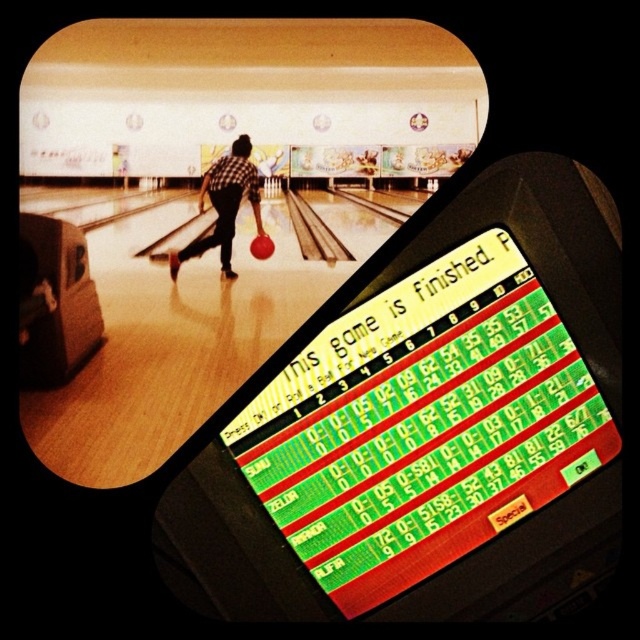
Question: Can you confirm if checkered fabric shirt at center is positioned to the right of shiny red bowling ball at center?

Choices:
 (A) yes
 (B) no

Answer: (B)

Question: Which object appears farthest from the camera in this image?

Choices:
 (A) checkered fabric shirt at center
 (B) shiny red bowling ball at center

Answer: (B)

Question: Which of the following is the closest to the observer?

Choices:
 (A) (257, 221)
 (B) (256, 243)

Answer: (B)

Question: Can you confirm if checkered fabric shirt at center is positioned to the right of shiny red bowling ball at center?

Choices:
 (A) no
 (B) yes

Answer: (A)

Question: Is checkered fabric shirt at center behind shiny red bowling ball at center?

Choices:
 (A) yes
 (B) no

Answer: (B)